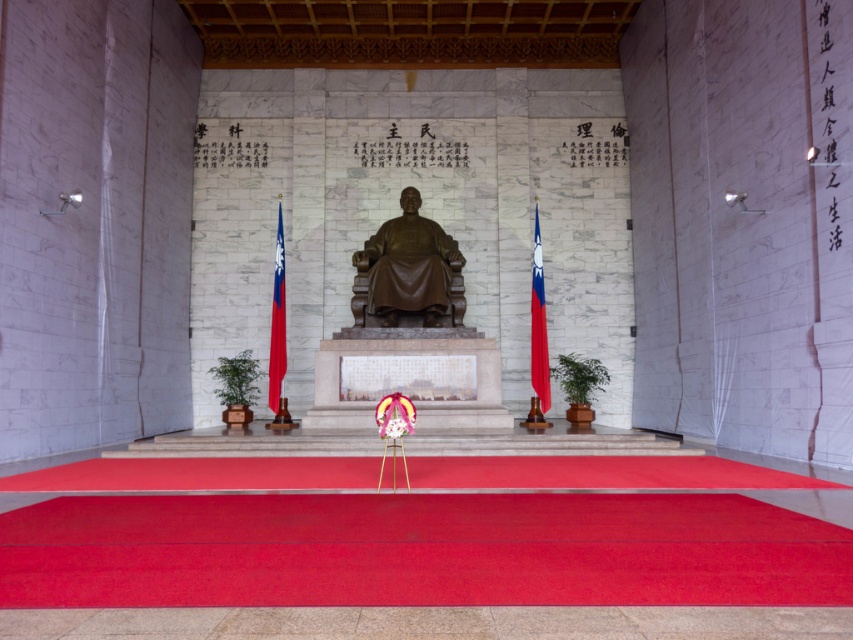
You are a visitor in this memorial hall and want to take a photo of both the bronze statue at center and the red fabric flag at center. Considering their sizes, which object should you focus on first to ensure both are fully captured in the frame?

The bronze statue at center is wider than the red fabric flag at center, so you should focus on the bronze statue at center first to ensure both are fully captured in the frame.

You are a photographer standing at the camera position. You want to take a photo of the red fabric flag at center. The camera has a maximum focus range of 10 meters. Will the camera be able to focus on the flag?

The red fabric flag at center and camera are 9.94 meters apart from each other, so yes, the camera can focus on the flag since the distance is within the maximum focus range of 10 meters.

You are a visitor standing in the memorial hall. You see a point marked at coordinates (277, 326). What object is located at this point?

The point at coordinates (277, 326) marks the red fabric flag at center.